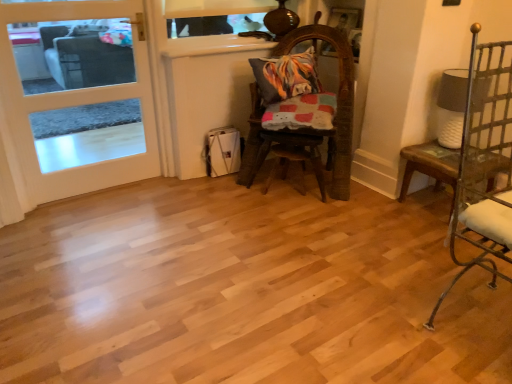
Question: In terms of width, does white textured lampshade at right look wider or thinner when compared to white ceramic table at right?

Choices:
 (A) thin
 (B) wide

Answer: (A)

Question: Is white textured lampshade at right inside or outside of white ceramic table at right?

Choices:
 (A) inside
 (B) outside

Answer: (B)

Question: Which of these objects is positioned farthest from the metallic silver chair at right, the 1th chair from the front?

Choices:
 (A) worn wood chair at center, the second chair in the front-to-back sequence
 (B) white ceramic table at right
 (C) white wood door at left
 (D) multicolored fabric pillow at center
 (E) white textured lampshade at right

Answer: (C)

Question: Which of these objects is positioned closest to the white textured lampshade at right?

Choices:
 (A) worn wood chair at center, the second chair in the front-to-back sequence
 (B) multicolored fabric pillow at center
 (C) white wood door at left
 (D) metallic silver chair at right, positioned as the 2th chair in back-to-front order
 (E) white ceramic table at right

Answer: (E)